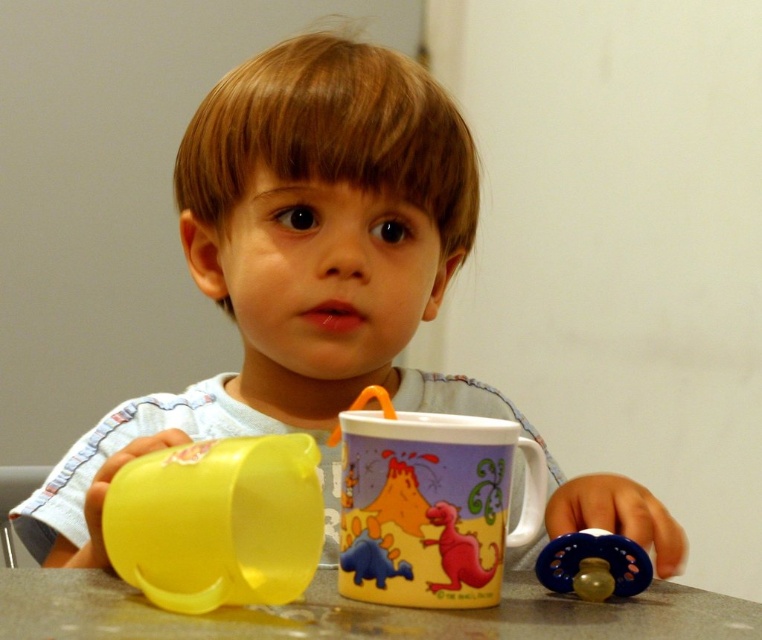
The child wants to place the matte ceramic mug at center on the smooth granite table at center. Will the mug fit entirely on the table?

The matte ceramic mug at center has a width less than the smooth granite table at center, so the mug will fit entirely on the table.